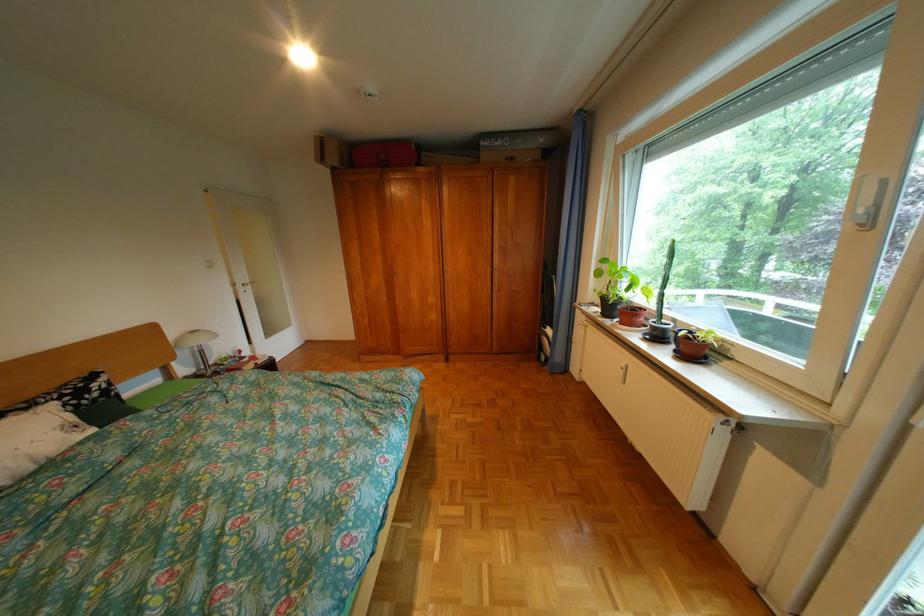
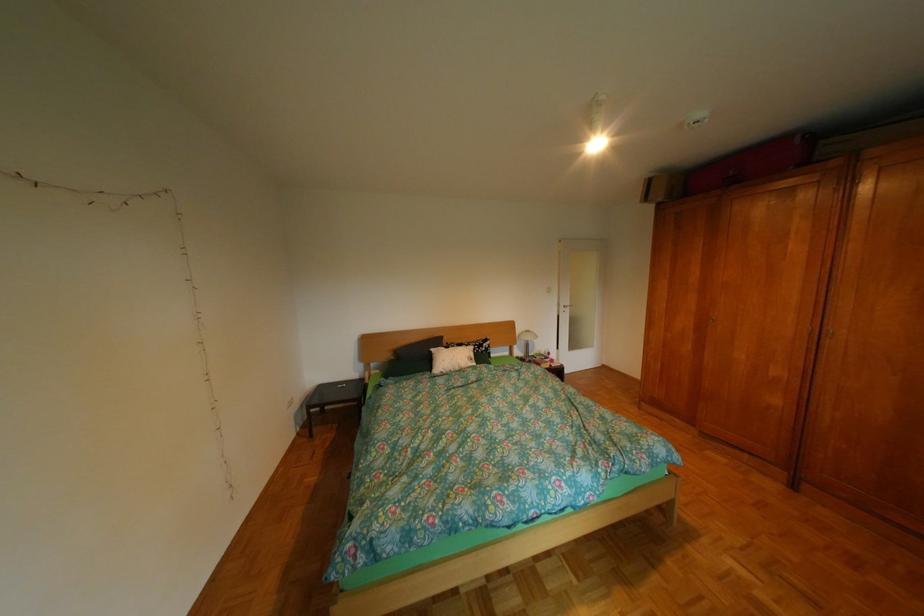
In the second image, find the point that corresponds to the point at 171,371 in the first image.

(523, 349)